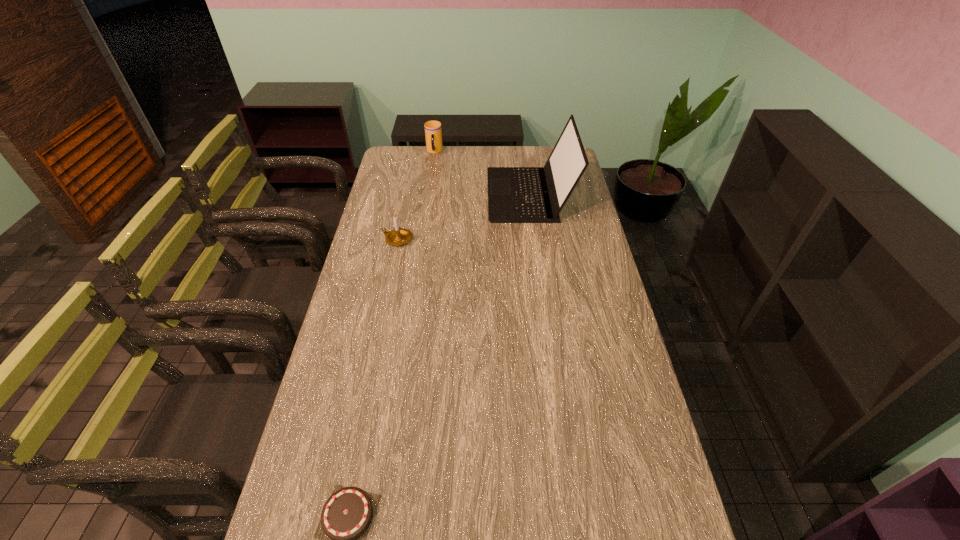
The image size is (960, 540). I want to click on cup situated at the far edge, so click(x=433, y=132).

This screenshot has height=540, width=960. I want to click on object situated at the left edge, so click(398, 236).

Locate an element on the screen. The width and height of the screenshot is (960, 540). object located at the right edge is located at coordinates (515, 194).

Find the location of `object that is at the far right corner`. object that is at the far right corner is located at coordinates (515, 194).

At what (x,y) coordinates should I click in order to perform the action: click on vacant space at the left edge. Please return your answer as a coordinate pair (x, y). The height and width of the screenshot is (540, 960). Looking at the image, I should click on (329, 429).

You are a GUI agent. You are given a task and a screenshot of the screen. Output one action in this format:
    pyautogui.click(x=<x>, y=<y>)
    Task: Click on the free space at the right edge of the desktop
    The height and width of the screenshot is (540, 960).
    Given the screenshot: What is the action you would take?
    pyautogui.click(x=607, y=366)

This screenshot has width=960, height=540. Find the location of `free space between the second nearest object and the cup`. free space between the second nearest object and the cup is located at coordinates (416, 195).

Locate an element on the screen. Image resolution: width=960 pixels, height=540 pixels. vacant area between the cup and the third nearest object is located at coordinates tap(482, 173).

I want to click on empty space that is in between the candle holder and the second farthest object, so click(x=464, y=217).

The image size is (960, 540). What are the coordinates of `vacant area that lies between the candle holder and the laptop` in the screenshot? It's located at (464, 217).